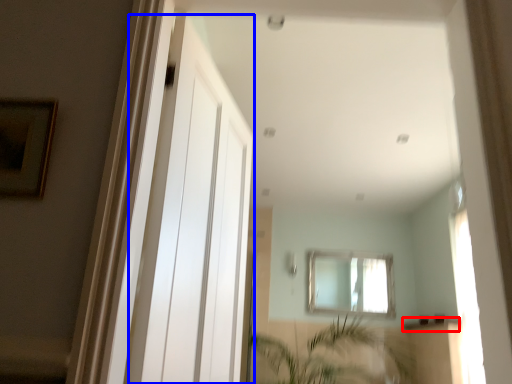
Question: Which object is closer to the camera taking this photo, window sill (highlighted by a red box) or screen door (highlighted by a blue box)?

Choices:
 (A) window sill
 (B) screen door

Answer: (B)